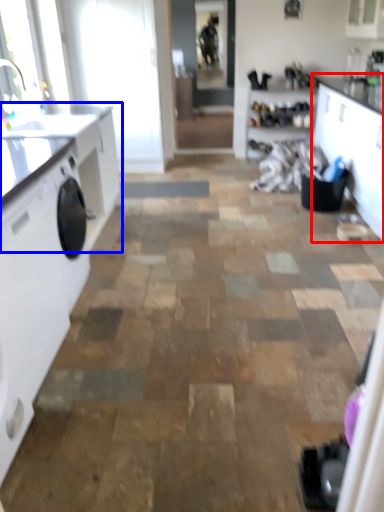
Question: Which point is further to the camera, cabinetry (highlighted by a red box) or countertop (highlighted by a blue box)?

Choices:
 (A) cabinetry
 (B) countertop

Answer: (B)